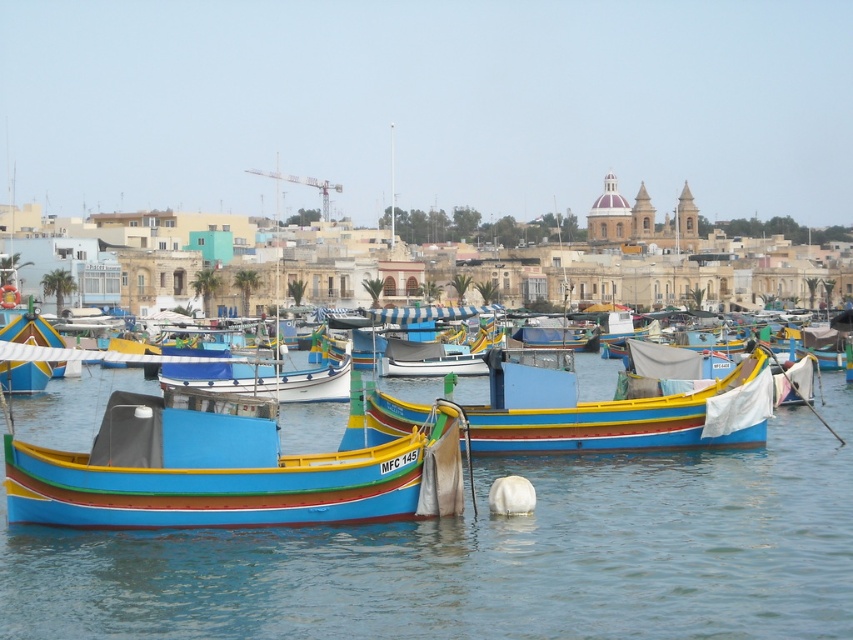
Between multicolored wooden boat at center and multicolored painted boat at center, which one is positioned lower?

multicolored wooden boat at center is lower down.

Is multicolored wooden boat at center below multicolored painted boat at center?

Yes, multicolored wooden boat at center is below multicolored painted boat at center.

Who is more distant from viewer, (x=445, y=497) or (x=492, y=442)?

Point (x=492, y=442)

The width and height of the screenshot is (853, 640). I want to click on multicolored wooden boat at center, so click(225, 474).

Between point (383, 577) and point (560, 429), which one is positioned behind?

The point (560, 429) is behind.

Locate an element on the screen. The image size is (853, 640). blue water at center is located at coordinates (491, 556).

Identify the location of blue water at center. (491, 556).

Can you confirm if blue water at center is taller than multicolored wooden boat at center?

Indeed, blue water at center has a greater height compared to multicolored wooden boat at center.

Is blue water at center wider than multicolored wooden boat at center?

Correct, the width of blue water at center exceeds that of multicolored wooden boat at center.

Is point (254, 573) positioned behind point (317, 499)?

That is False.

This screenshot has height=640, width=853. What are the coordinates of `blue water at center` in the screenshot? It's located at pyautogui.click(x=491, y=556).